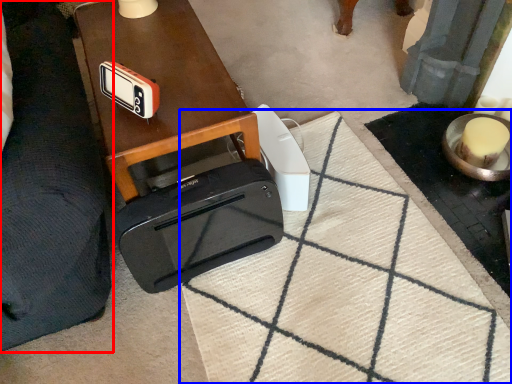
Question: Which object appears farthest to the camera in this image, furniture (highlighted by a red box) or doormat (highlighted by a blue box)?

Choices:
 (A) furniture
 (B) doormat

Answer: (B)